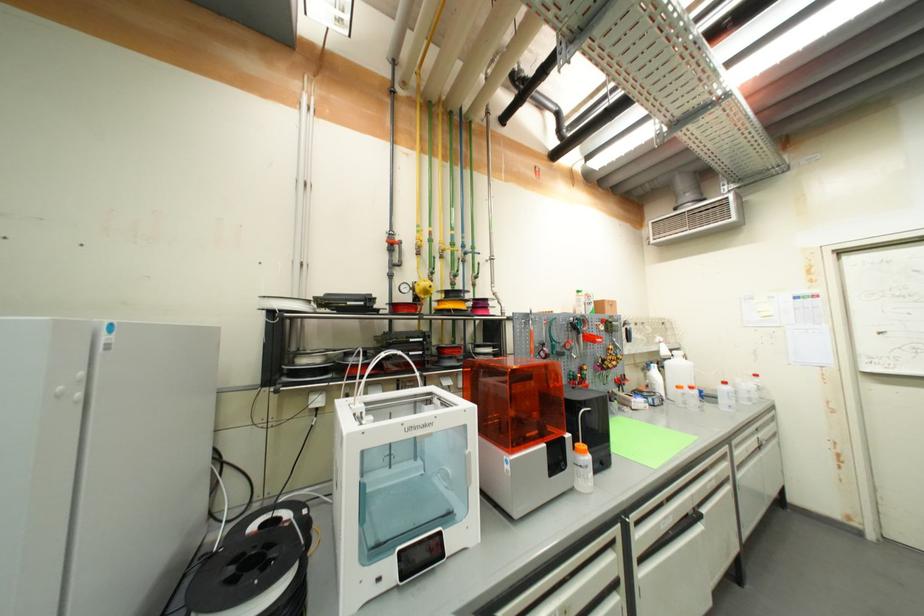
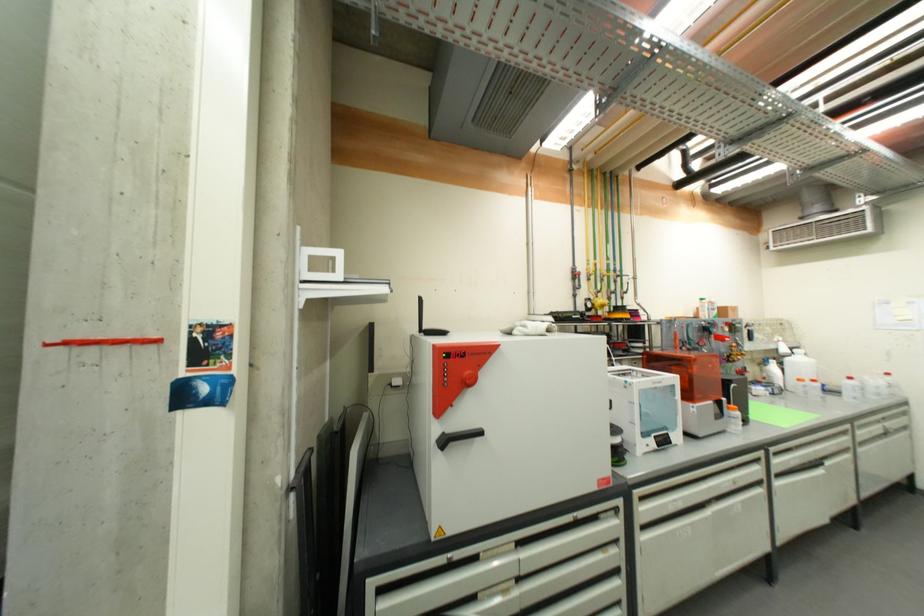
Locate, in the second image, the point that corresponds to pixel 589 454 in the first image.

(739, 411)